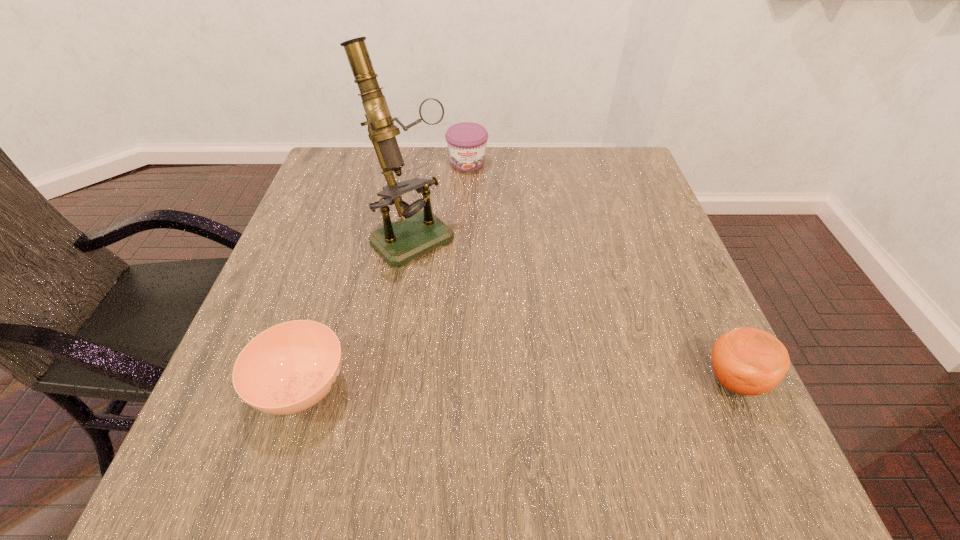
Locate an element on the screen. The width and height of the screenshot is (960, 540). vacant area that lies between the tallest object and the third tallest object is located at coordinates (440, 199).

Find the location of a particular element. The height and width of the screenshot is (540, 960). vacant area between the third tallest object and the microscope is located at coordinates (440, 199).

The height and width of the screenshot is (540, 960). I want to click on blank region between the rightmost object and the farthest object, so click(x=601, y=271).

Find the location of a particular element. Image resolution: width=960 pixels, height=540 pixels. free area in between the third nearest object and the shortest object is located at coordinates (357, 312).

The height and width of the screenshot is (540, 960). I want to click on unoccupied area between the third tallest object and the second tallest object, so click(601, 271).

The image size is (960, 540). What are the coordinates of `empty space between the jam and the soup bowl` in the screenshot? It's located at (385, 275).

Where is `free space between the second shortest object and the tallest object`? This screenshot has width=960, height=540. free space between the second shortest object and the tallest object is located at coordinates (440, 199).

Identify the location of object that stands as the closest to the jam. (419, 232).

Locate an element on the screen. The image size is (960, 540). object that ranks as the closest to the shortest object is located at coordinates [x=419, y=232].

Find the location of `blank area in the image that satisfies the following two spatial constraints: 1. on the back side of the soup bowl; 2. on the right side of the second farthest object`. blank area in the image that satisfies the following two spatial constraints: 1. on the back side of the soup bowl; 2. on the right side of the second farthest object is located at coordinates (349, 236).